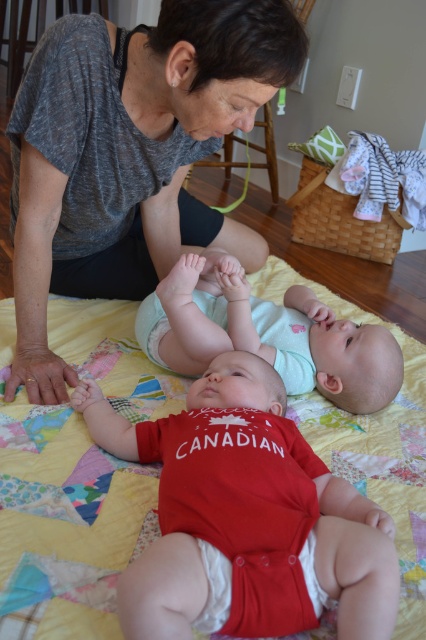
Question: Is gray textured shirt at upper left further to camera compared to light blue fabric diaper at center?

Choices:
 (A) no
 (B) yes

Answer: (A)

Question: Which is farther from the light blue fabric diaper at center?

Choices:
 (A) white cloth diaper at lower center
 (B) matte red onesie at center
 (C) gray textured shirt at upper left

Answer: (A)

Question: Which object is farther from the camera taking this photo?

Choices:
 (A) light blue fabric diaper at center
 (B) matte red onesie at center
 (C) gray textured shirt at upper left
 (D) white cloth diaper at lower center

Answer: (A)

Question: Is matte red onesie at center below white cloth diaper at lower center?

Choices:
 (A) yes
 (B) no

Answer: (B)

Question: Can you confirm if matte red onesie at center is positioned above light blue fabric diaper at center?

Choices:
 (A) no
 (B) yes

Answer: (A)

Question: Which object is the farthest from the light blue fabric diaper at center?

Choices:
 (A) white cloth diaper at lower center
 (B) matte red onesie at center
 (C) gray textured shirt at upper left

Answer: (A)